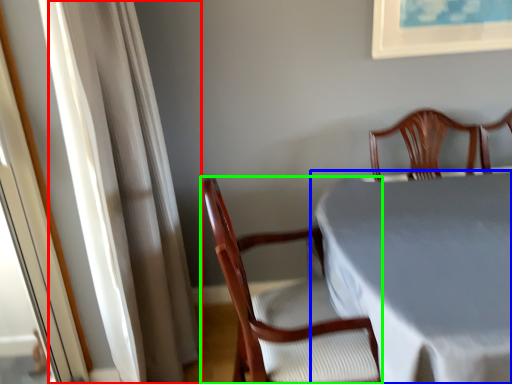
Question: Which object is positioned farthest from curtain (highlighted by a red box)? Select from table (highlighted by a blue box) and chair (highlighted by a green box).

Choices:
 (A) table
 (B) chair

Answer: (A)